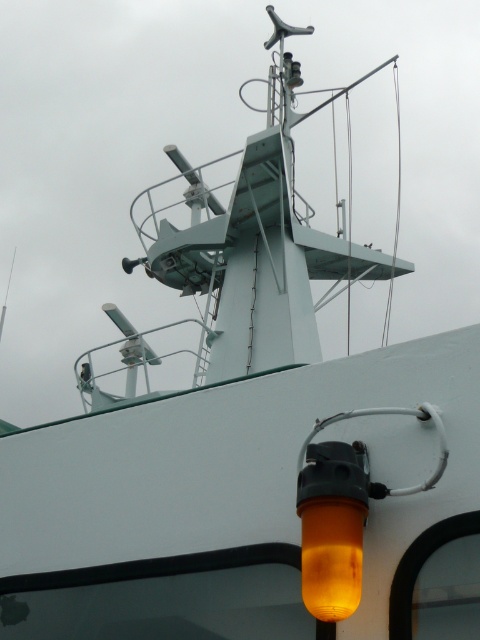
Between orange translucent lamp at lower right and orange translucent light at lower right, which one has more height?

With more height is orange translucent lamp at lower right.

Can you confirm if orange translucent lamp at lower right is positioned to the right of orange translucent light at lower right?

Indeed, orange translucent lamp at lower right is positioned on the right side of orange translucent light at lower right.

Between point (317, 504) and point (345, 516), which one is positioned in front?

Positioned in front is point (345, 516).

Find the location of a particular element. This screenshot has width=480, height=640. orange translucent lamp at lower right is located at coordinates (343, 512).